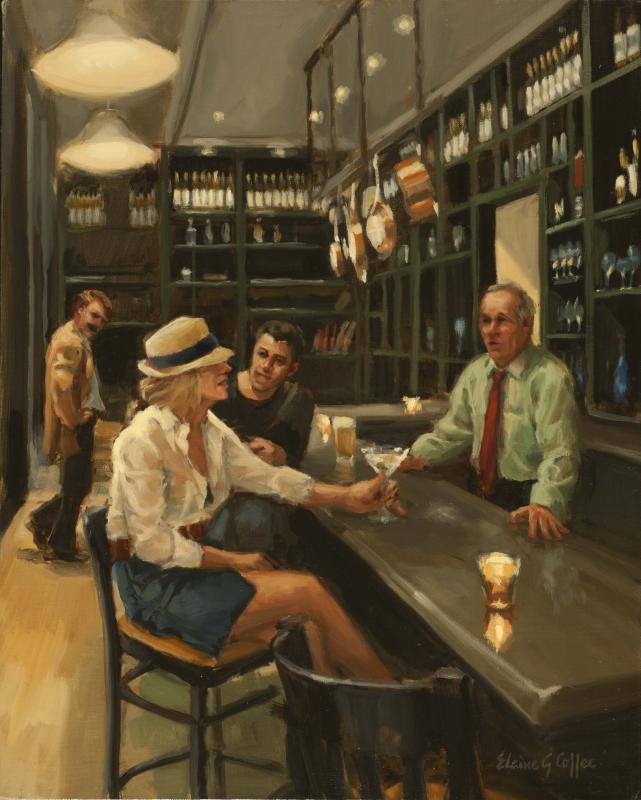
I want to click on bar top, so click(x=547, y=630), click(x=424, y=520), click(x=377, y=409).